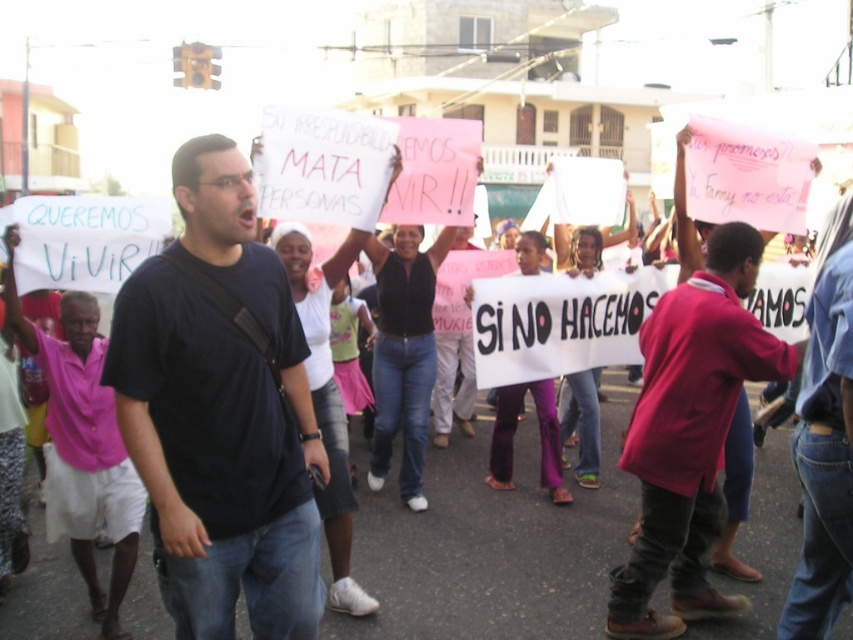
What is located at the coordinate point (219, 412) in the image?

The point (219, 412) corresponds to the dark blue t shirt at center.